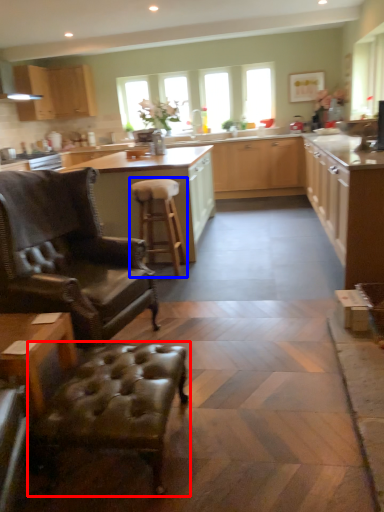
Question: Among these objects, which one is nearest to the camera, swivel chair (highlighted by a red box) or stool (highlighted by a blue box)?

Choices:
 (A) swivel chair
 (B) stool

Answer: (A)